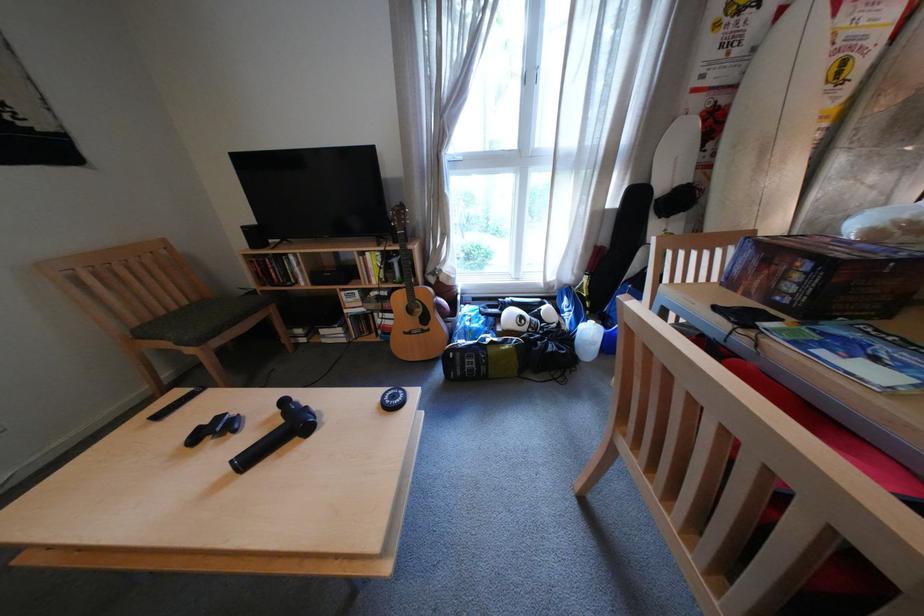
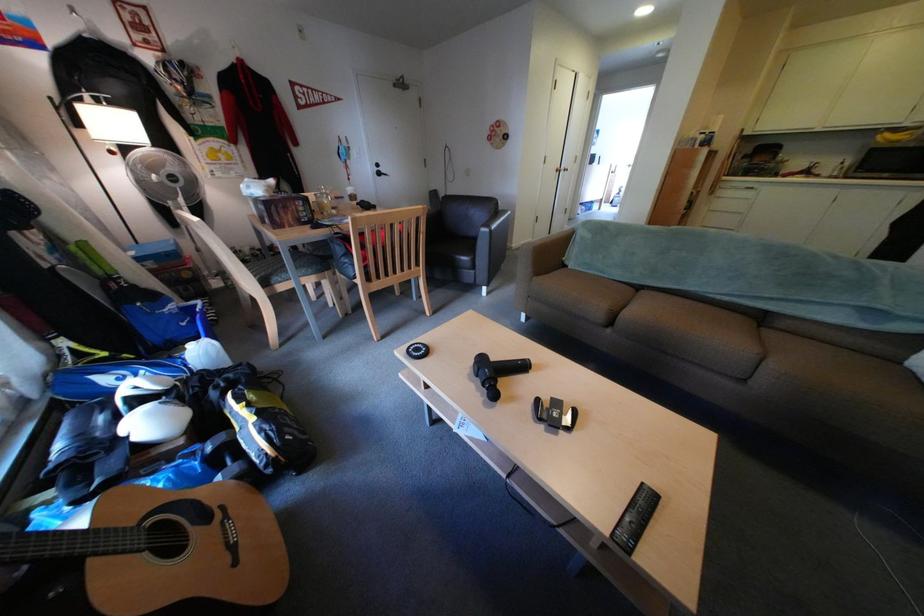
Find the pixel in the second image that matches pixel 431 299 in the first image.

(148, 527)